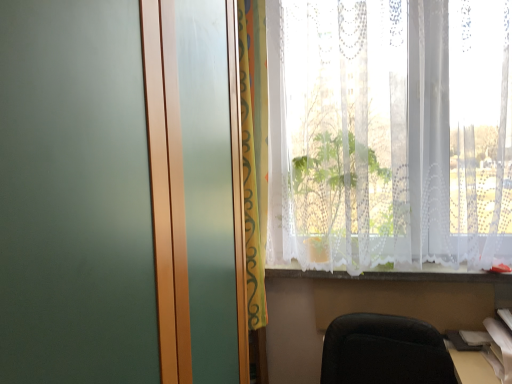
Question: In terms of height, does white paper at lower right look taller or shorter compared to multicolored fabric curtain at center?

Choices:
 (A) short
 (B) tall

Answer: (A)

Question: From the image's perspective, is white paper at lower right positioned above or below multicolored fabric curtain at center?

Choices:
 (A) above
 (B) below

Answer: (B)

Question: Estimate the real-world distances between objects in this image. Which object is farther from the white lace curtain at lower center?

Choices:
 (A) multicolored fabric curtain at center
 (B) white lace curtain at upper right
 (C) black leather chair at lower right
 (D) white paper at lower right

Answer: (A)

Question: Estimate the real-world distances between objects in this image. Which object is farther from the multicolored fabric curtain at center?

Choices:
 (A) white lace curtain at upper right
 (B) white paper at lower right
 (C) white lace curtain at lower center
 (D) black leather chair at lower right

Answer: (B)